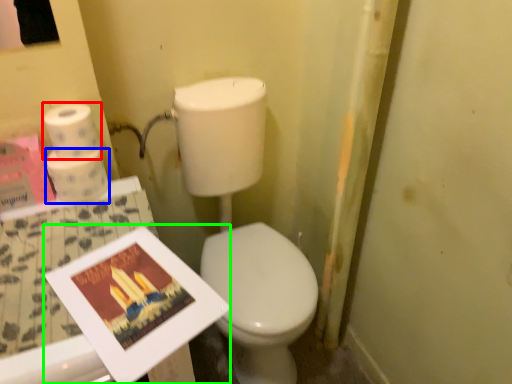
Question: Estimate the real-world distances between objects in this image. Which object is closer to toilet paper (highlighted by a red box), toilet paper (highlighted by a blue box) or magazine (highlighted by a green box)?

Choices:
 (A) toilet paper
 (B) magazine

Answer: (A)